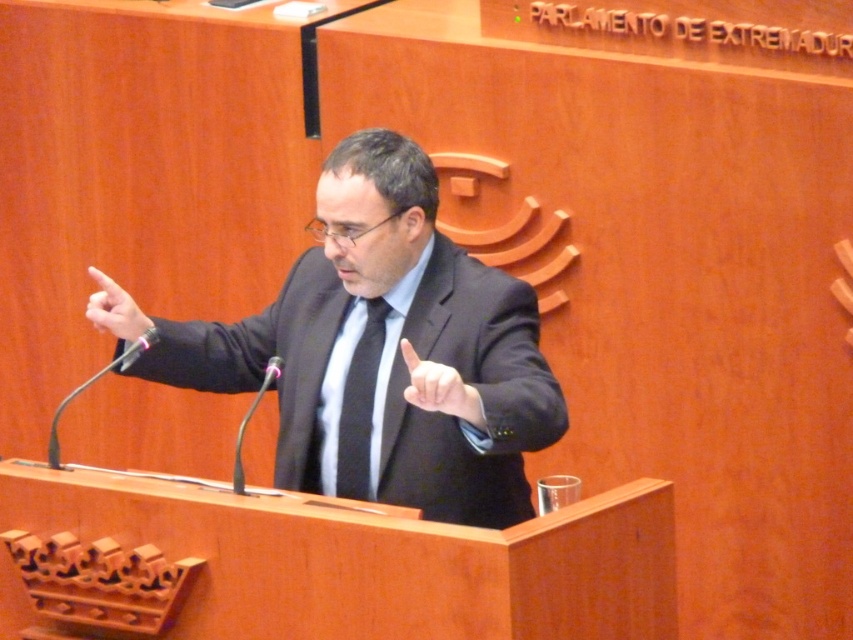
Question: Is the position of matte black suit at center less distant than that of black silk tie at center?

Choices:
 (A) no
 (B) yes

Answer: (B)

Question: Which point is closer to the camera taking this photo?

Choices:
 (A) (512, 476)
 (B) (373, 349)

Answer: (A)

Question: Can you confirm if matte black suit at center is wider than black silk tie at center?

Choices:
 (A) yes
 (B) no

Answer: (A)

Question: Does matte black suit at center come in front of black silk tie at center?

Choices:
 (A) yes
 (B) no

Answer: (A)